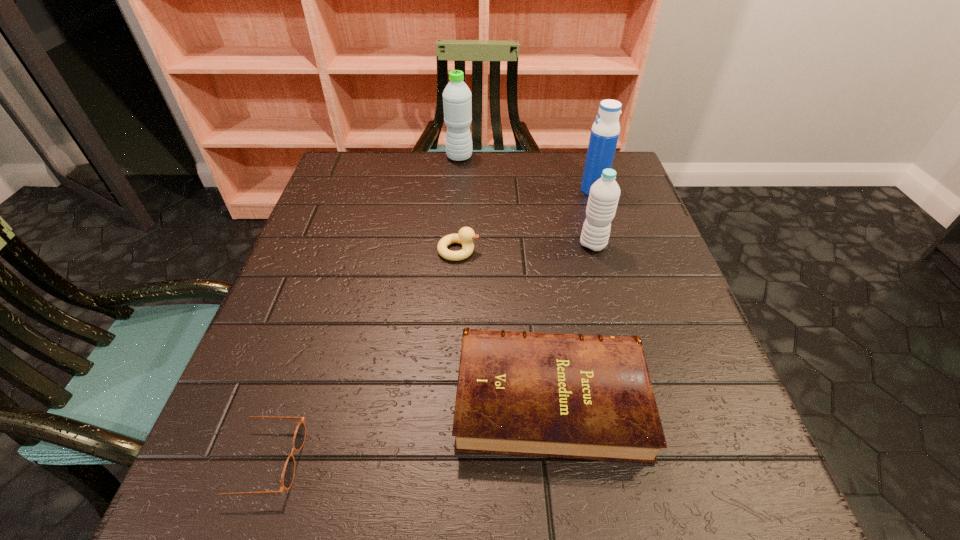
Where is `water bottle that is the second closest one to the fourth shortest object`? This screenshot has width=960, height=540. water bottle that is the second closest one to the fourth shortest object is located at coordinates (457, 103).

I want to click on blank area in the image that satisfies the following two spatial constraints: 1. on the front side of the leftmost water bottle; 2. on the left side of the fourth shortest object, so click(454, 245).

Identify the location of vacant space that satisfies the following two spatial constraints: 1. at the beak of the duckling; 2. on the right side of the hardback book. This screenshot has width=960, height=540. (450, 397).

At what (x,y) coordinates should I click in order to perform the action: click on vacant space that satisfies the following two spatial constraints: 1. on the front side of the shortest water bottle; 2. on the front-facing side of the leftmost object. Please return your answer as a coordinate pair (x, y). The image size is (960, 540). Looking at the image, I should click on (653, 461).

The height and width of the screenshot is (540, 960). In order to click on vacant position in the image that satisfies the following two spatial constraints: 1. on the back side of the second farthest object; 2. on the left side of the hardback book in this screenshot , I will do `click(524, 191)`.

Locate an element on the screen. Image resolution: width=960 pixels, height=540 pixels. blank space that satisfies the following two spatial constraints: 1. on the front side of the leftmost water bottle; 2. on the left side of the fourth shortest object is located at coordinates (454, 245).

Identify the location of free location that satisfies the following two spatial constraints: 1. on the front side of the farthest water bottle; 2. on the front-facing side of the shortest object. (440, 461).